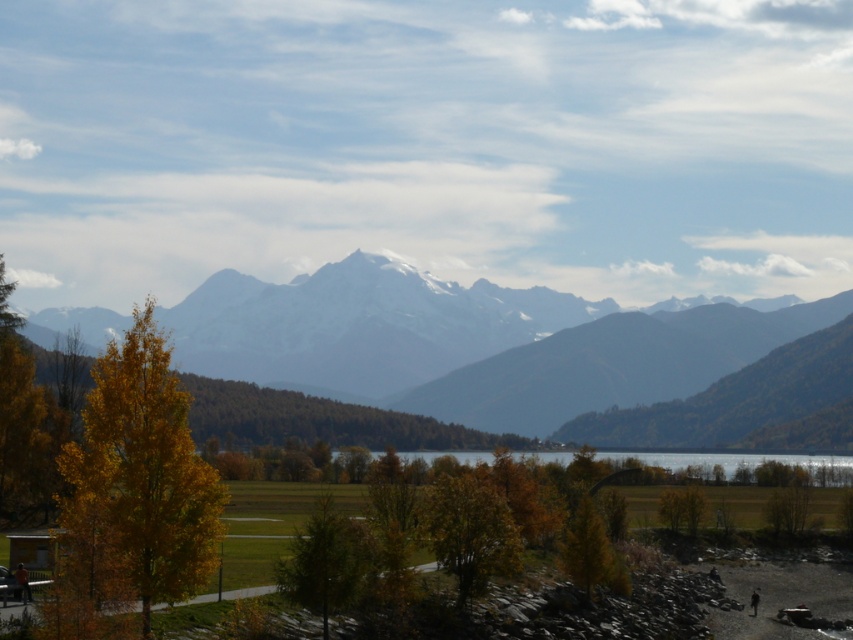
Question: Observing the image, what is the correct spatial positioning of golden leafy tree at left in reference to green matte tree at center?

Choices:
 (A) right
 (B) left

Answer: (B)

Question: Can you confirm if green matte tree at center is smaller than clear glass lake at center?

Choices:
 (A) no
 (B) yes

Answer: (B)

Question: In this image, where is snowy mountain range at center located relative to golden yellow leaves at left?

Choices:
 (A) below
 (B) above

Answer: (A)

Question: Which of the following is the farthest from the observer?

Choices:
 (A) (795, 456)
 (B) (294, 577)
 (C) (579, 550)

Answer: (A)

Question: Which of the following is the farthest from the observer?

Choices:
 (A) (16, 481)
 (B) (451, 493)
 (C) (583, 509)

Answer: (A)

Question: Estimate the real-world distances between objects in this image. Which object is farther from the clear glass lake at center?

Choices:
 (A) golden yellow leaves at left
 (B) yellow matte tree at lower center
 (C) golden leafy tree at left
 (D) golden-brown textured tree at center

Answer: (A)